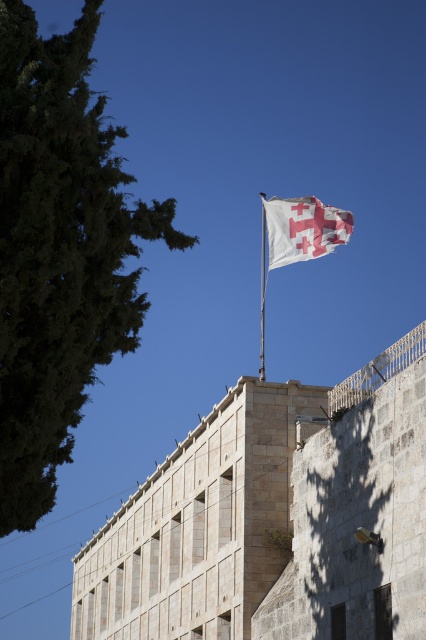
Can you confirm if white fabric flag at upper center is positioned below white fabric flag pole at upper center?

No, white fabric flag at upper center is not below white fabric flag pole at upper center.

Between white fabric flag at upper center and white fabric flag pole at upper center, which one has less height?

Standing shorter between the two is white fabric flag at upper center.

Where is `white fabric flag at upper center`? white fabric flag at upper center is located at coordinates (304, 228).